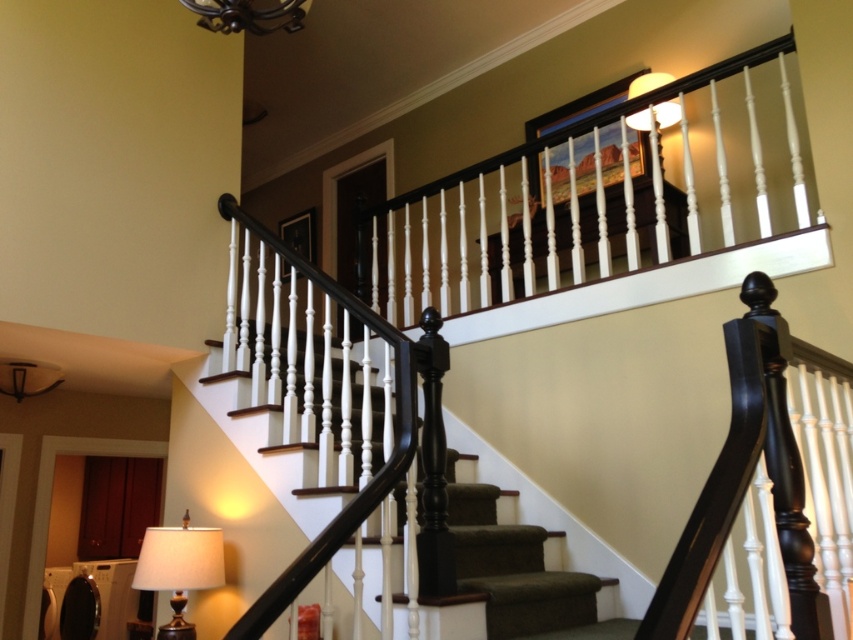
Does black matte stair rail at upper center appear under gold metallic lamp at lower left?

Actually, black matte stair rail at upper center is above gold metallic lamp at lower left.

Can you confirm if black matte stair rail at upper center is positioned above gold metallic lamp at lower left?

Indeed, black matte stair rail at upper center is positioned over gold metallic lamp at lower left.

This screenshot has width=853, height=640. What do you see at coordinates (469, 301) in the screenshot? I see `black matte stair rail at upper center` at bounding box center [469, 301].

Identify the location of black matte stair rail at upper center. Image resolution: width=853 pixels, height=640 pixels. [x=469, y=301].

Who is lower down, black matte stair rail at upper center or metallic chandelier at upper center?

black matte stair rail at upper center

Who is more forward, (409,545) or (216,22)?

Point (216,22) is more forward.

Locate an element on the screen. Image resolution: width=853 pixels, height=640 pixels. black matte stair rail at upper center is located at coordinates (469, 301).

Is point (49, 385) positioned after point (660, 112)?

That is True.

Locate an element on the screen. Image resolution: width=853 pixels, height=640 pixels. matte white lampshade at upper left is located at coordinates (27, 378).

Is point (45, 368) behind point (656, 86)?

That is True.

Find the location of `matte white lampshade at upper left`. matte white lampshade at upper left is located at coordinates (27, 378).